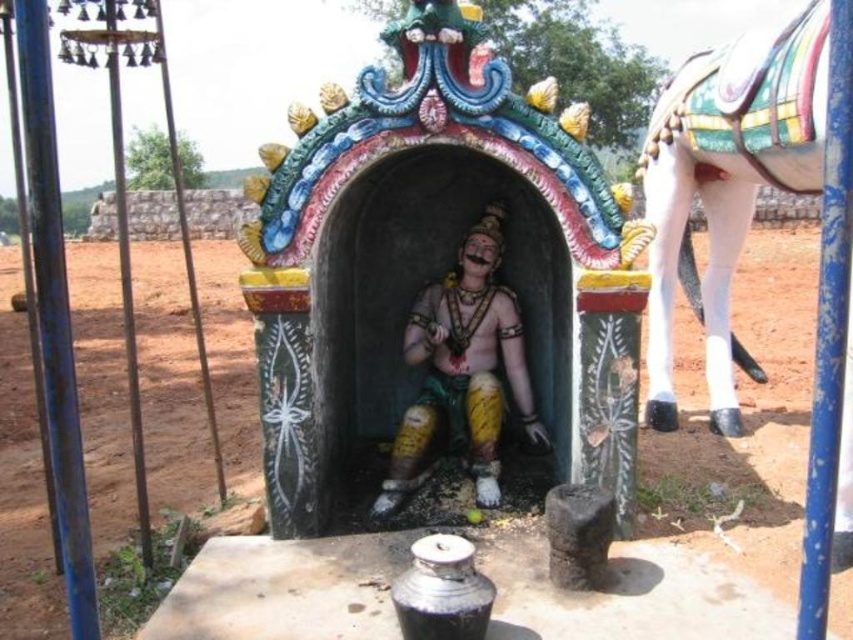
You are an architect designing a new temple and need to place the white glossy horse at right and the polished bronze statue at center in a row. Which object should be placed first if you want to maintain the order from widest to narrowest?

The polished bronze statue at center should be placed first since it is wider than the white glossy horse at right.

You are a visitor standing in front of the shrine. You want to take a photo of the polished bronze statue at center and the white glossy horse at right. Which object should you position closer to the left side of your camera frame to include both in the photo?

The polished bronze statue at center should be positioned closer to the left side of your camera frame because the white glossy horse at right is already to the right of it, so placing the statue on the left allows both to fit within the frame.

You are standing in front of the shrine and want to determine the relative positions of two points marked on the structure. Which point is closer to you, point (764, 182) or point (432, 404)?

Point (764, 182) is closer to you than point (432, 404) because it is further to the viewer according to the description.